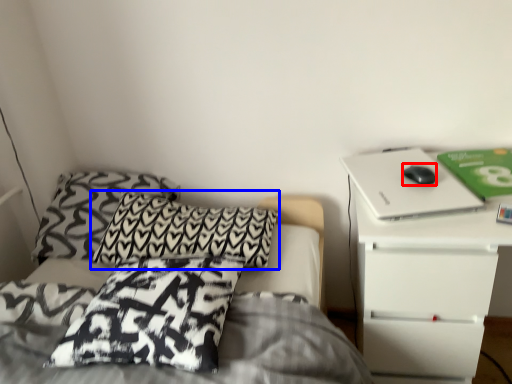
Question: Which object is further to the camera taking this photo, mouse (highlighted by a red box) or pillow (highlighted by a blue box)?

Choices:
 (A) mouse
 (B) pillow

Answer: (B)